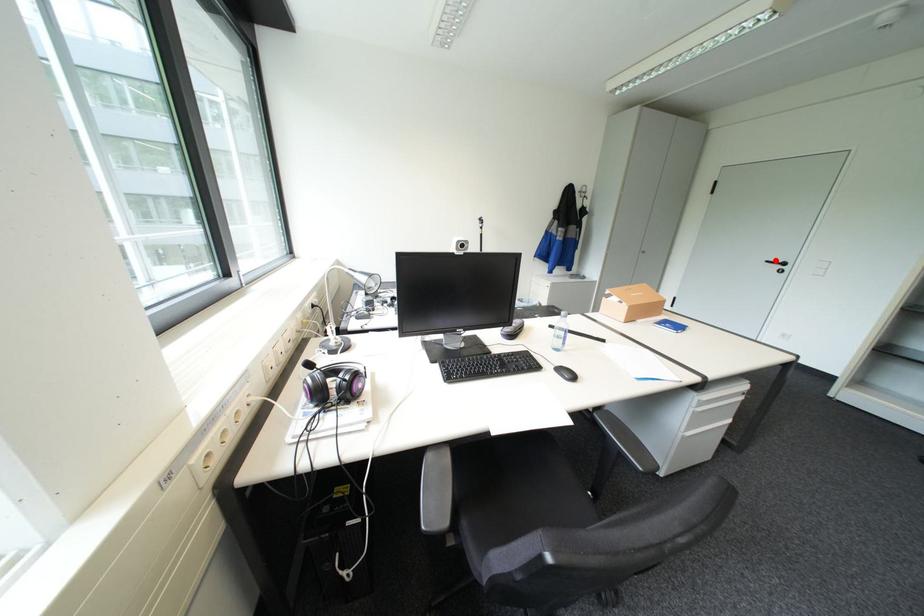
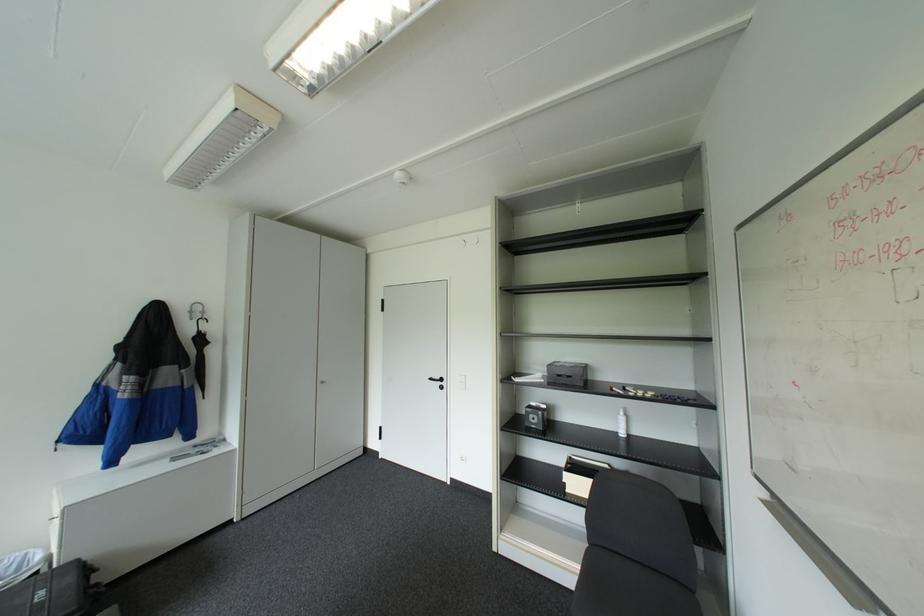
Find the pixel in the second image that matches the highlighted location in the first image.

(439, 378)